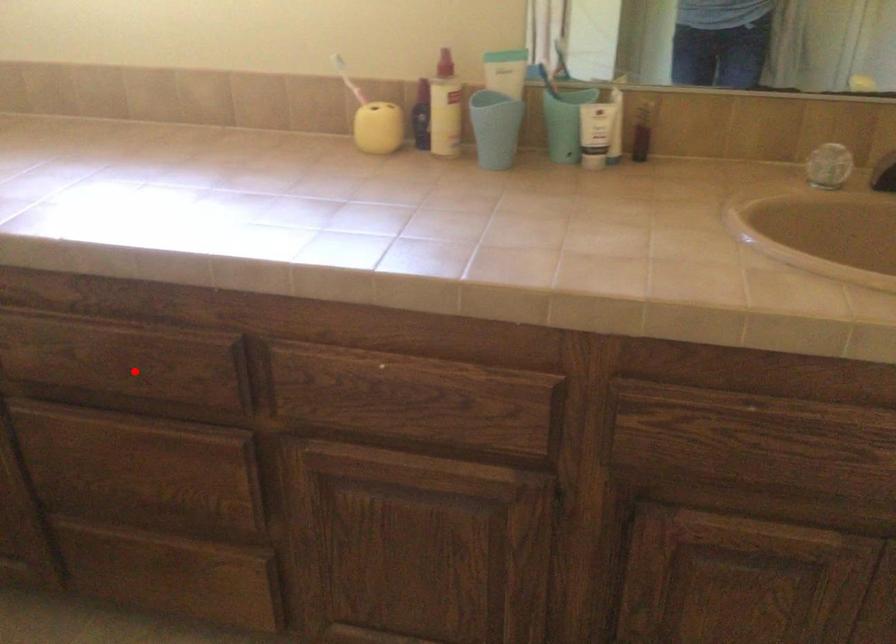
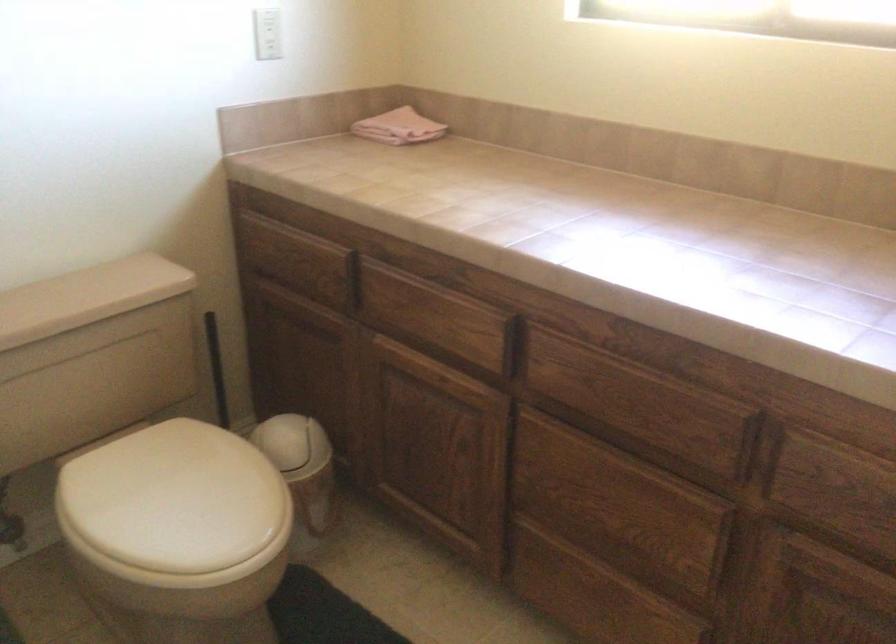
Question: I am providing you with two images of the same scene from different viewpoints. A red point is marked on the first image. At the location where the point appears in image 1, is it still visible in image 2?

Choices:
 (A) Yes
 (B) No

Answer: (A)